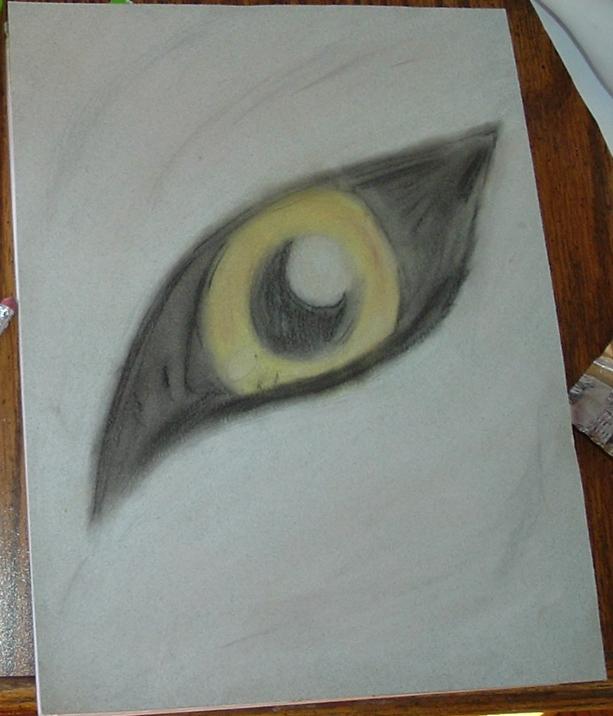
Find the location of a particular element. This screenshot has width=613, height=716. corners is located at coordinates (97, 516), (493, 130).